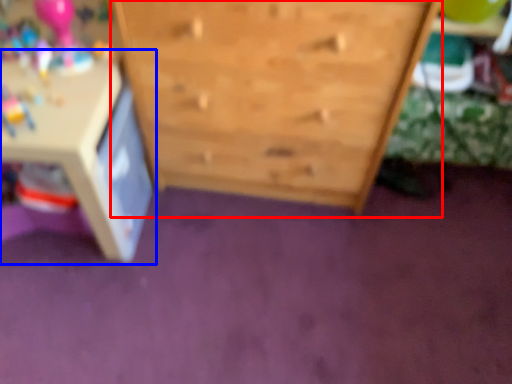
Question: Which object is further to the camera taking this photo, chest of drawers (highlighted by a red box) or table (highlighted by a blue box)?

Choices:
 (A) chest of drawers
 (B) table

Answer: (B)